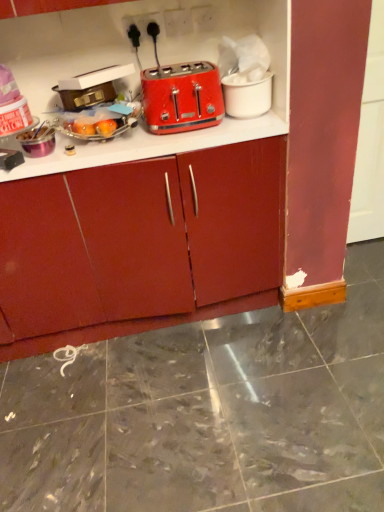
Question: Can we say white matte cup at upper right, placed as the 2th appliance when sorted from left to right, lies outside metallic gold suitcase at upper left, placed as the 2th appliance when sorted from right to left?

Choices:
 (A) no
 (B) yes

Answer: (B)

Question: Is white matte cup at upper right, which is the first appliance in right-to-left order, with metallic gold suitcase at upper left, placed as the 2th appliance when sorted from right to left?

Choices:
 (A) no
 (B) yes

Answer: (A)

Question: Is white matte cup at upper right, which is the first appliance in right-to-left order, at the left side of metallic gold suitcase at upper left, the first appliance positioned from the left?

Choices:
 (A) yes
 (B) no

Answer: (B)

Question: Can you confirm if white matte cup at upper right, which is the first appliance in right-to-left order, is taller than metallic gold suitcase at upper left, placed as the 2th appliance when sorted from right to left?

Choices:
 (A) yes
 (B) no

Answer: (A)

Question: Is white matte cup at upper right, placed as the 2th appliance when sorted from left to right, oriented away from metallic gold suitcase at upper left, the first appliance positioned from the left?

Choices:
 (A) no
 (B) yes

Answer: (A)

Question: Does white matte cup at upper right, placed as the 2th appliance when sorted from left to right, contain metallic gold suitcase at upper left, the first appliance positioned from the left?

Choices:
 (A) no
 (B) yes

Answer: (A)

Question: Considering the relative sizes of metallic gold suitcase at upper left, the first appliance positioned from the left, and matte plastic toaster at upper center in the image provided, is metallic gold suitcase at upper left, the first appliance positioned from the left, taller than matte plastic toaster at upper center?

Choices:
 (A) yes
 (B) no

Answer: (B)

Question: Considering the relative positions of metallic gold suitcase at upper left, the first appliance positioned from the left, and matte plastic toaster at upper center in the image provided, is metallic gold suitcase at upper left, the first appliance positioned from the left, behind matte plastic toaster at upper center?

Choices:
 (A) no
 (B) yes

Answer: (B)

Question: Is matte plastic toaster at upper center located within metallic gold suitcase at upper left, the first appliance positioned from the left?

Choices:
 (A) no
 (B) yes

Answer: (A)

Question: From the image's perspective, is metallic gold suitcase at upper left, the first appliance positioned from the left, on top of matte plastic toaster at upper center?

Choices:
 (A) yes
 (B) no

Answer: (B)

Question: Considering the relative sizes of metallic gold suitcase at upper left, placed as the 2th appliance when sorted from right to left, and matte plastic toaster at upper center in the image provided, is metallic gold suitcase at upper left, placed as the 2th appliance when sorted from right to left, shorter than matte plastic toaster at upper center?

Choices:
 (A) yes
 (B) no

Answer: (A)

Question: Is metallic gold suitcase at upper left, the first appliance positioned from the left, next to matte plastic toaster at upper center?

Choices:
 (A) no
 (B) yes

Answer: (A)

Question: Does matte plastic toaster at upper center lie in front of metallic gold suitcase at upper left, placed as the 2th appliance when sorted from right to left?

Choices:
 (A) yes
 (B) no

Answer: (A)